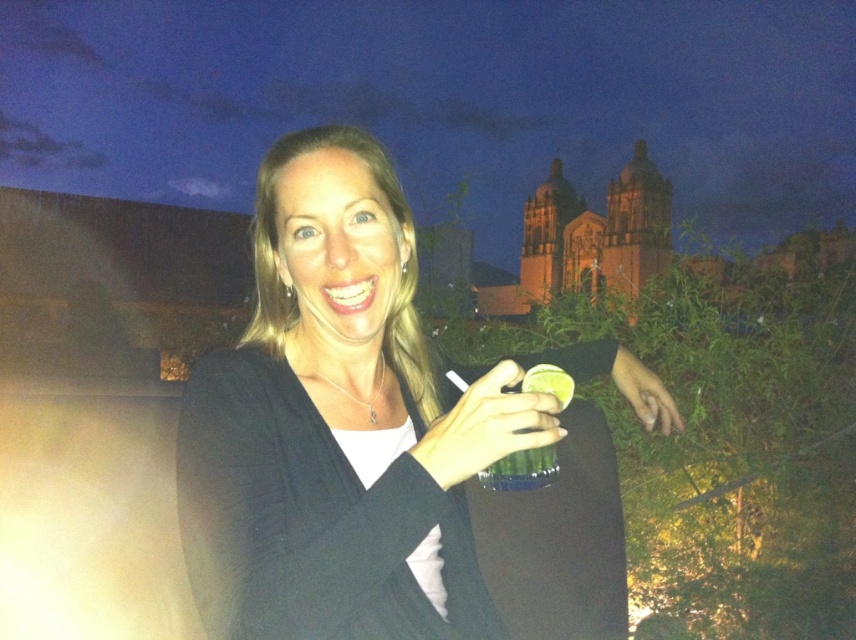
Question: Which point is closer to the camera?

Choices:
 (A) (547, 428)
 (B) (508, 384)

Answer: (A)

Question: Does matte black dress at center have a smaller size compared to matte plastic cup at center?

Choices:
 (A) yes
 (B) no

Answer: (B)

Question: Which point is farther to the camera?

Choices:
 (A) matte black dress at center
 (B) matte plastic cup at center

Answer: (B)

Question: Which point is closer to the camera taking this photo?

Choices:
 (A) (528, 440)
 (B) (262, 540)

Answer: (B)

Question: Can you confirm if matte black dress at center is positioned above matte plastic cup at center?

Choices:
 (A) no
 (B) yes

Answer: (B)

Question: Can you confirm if matte black dress at center is positioned to the left of matte plastic cup at center?

Choices:
 (A) no
 (B) yes

Answer: (B)